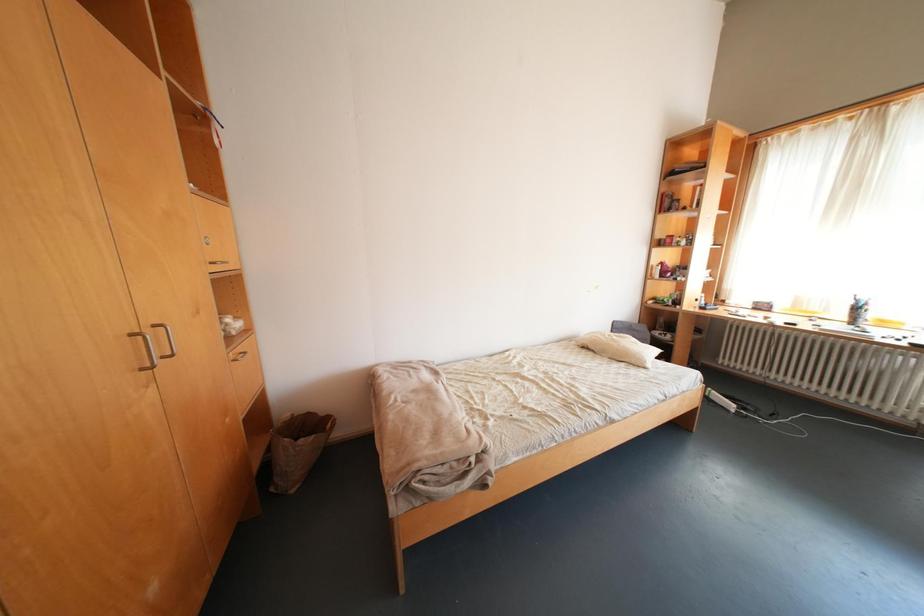
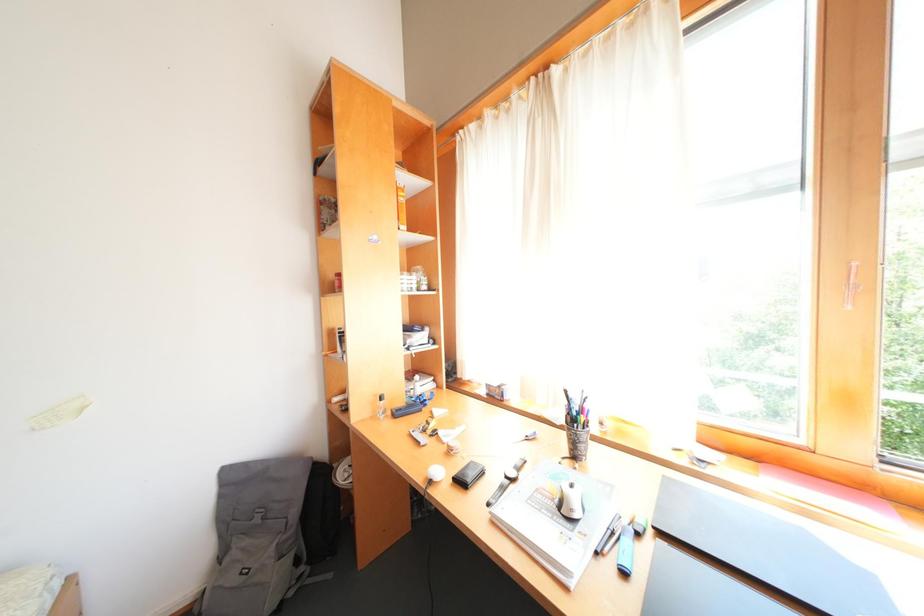
Which direction would the cameraman need to move to produce the second image?

The movement direction of the cameraman is right, forward.